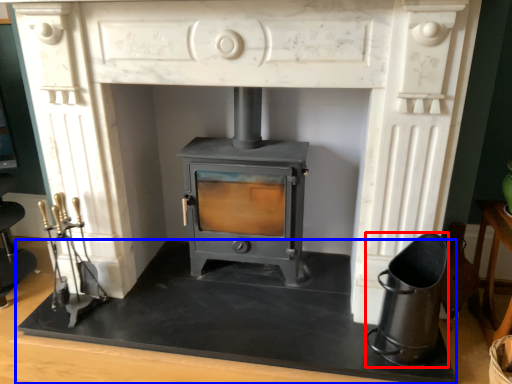
Question: Which point is closer to the camera, appliance (highlighted by a red box) or slate (highlighted by a blue box)?

Choices:
 (A) appliance
 (B) slate

Answer: (A)